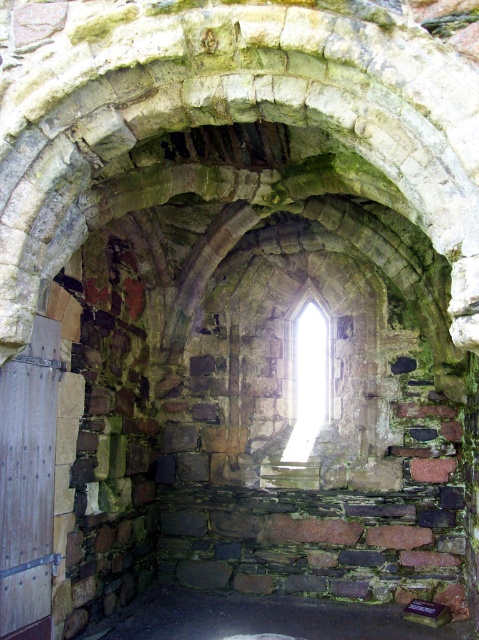
Can you confirm if wooden door at left is bigger than clear glass window at center?

Actually, wooden door at left might be smaller than clear glass window at center.

Between point (40, 340) and point (291, 440), which one is positioned in front?

Point (40, 340) is in front.

Image resolution: width=479 pixels, height=640 pixels. In order to click on wooden door at left in this screenshot , I will do `click(27, 483)`.

Is wooden door at left thinner than dark stone floor at center?

Indeed, wooden door at left has a lesser width compared to dark stone floor at center.

How far apart are wooden door at left and dark stone floor at center?

wooden door at left and dark stone floor at center are 6.85 feet apart from each other.

What do you see at coordinates (27, 483) in the screenshot?
I see `wooden door at left` at bounding box center [27, 483].

I want to click on wooden door at left, so click(27, 483).

Can you confirm if dark stone floor at center is positioned below clear glass window at center?

Correct, dark stone floor at center is located below clear glass window at center.

Does point (306, 611) lie behind point (303, 339)?

No, it is in front of (303, 339).

Is point (354, 636) positioned behind point (295, 403)?

No, it is in front of (295, 403).

This screenshot has width=479, height=640. What are the coordinates of `dark stone floor at center` in the screenshot? It's located at (261, 618).